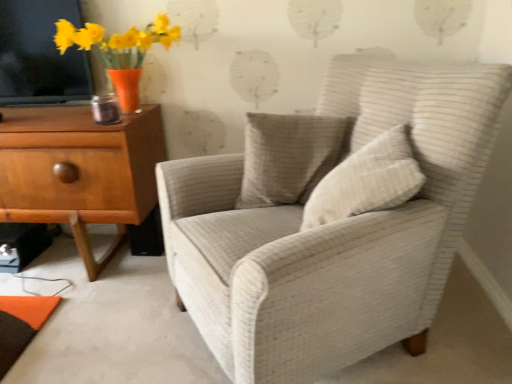
Describe the element at coordinates (119, 51) in the screenshot. I see `matte orange vase with yellow flowers at upper left` at that location.

The width and height of the screenshot is (512, 384). What do you see at coordinates (366, 181) in the screenshot?
I see `beige textured pillow at center, which ranks as the 2th pillow in back-to-front order` at bounding box center [366, 181].

What do you see at coordinates (289, 156) in the screenshot? This screenshot has width=512, height=384. I see `textured beige pillow at center, which ranks as the second pillow in front-to-back order` at bounding box center [289, 156].

This screenshot has width=512, height=384. Find the location of `matte orange vase with yellow flowers at upper left`. matte orange vase with yellow flowers at upper left is located at coordinates (119, 51).

Can you confirm if light brown wood chest of drawers at left is smaller than white textured armchair at center?

Yes.

Between point (15, 146) and point (463, 182), which one is positioned behind?

Positioned behind is point (15, 146).

Considering the positions of objects light brown wood chest of drawers at left and white textured armchair at center in the image provided, who is behind, light brown wood chest of drawers at left or white textured armchair at center?

Positioned behind is light brown wood chest of drawers at left.

Which object is positioned more to the left, light brown wood chest of drawers at left or white textured armchair at center?

light brown wood chest of drawers at left.

Consider the image. Is beige textured pillow at center, which ranks as the 2th pillow in back-to-front order, surrounded by white textured armchair at center?

Yes, beige textured pillow at center, which ranks as the 2th pillow in back-to-front order, is a part of white textured armchair at center.

Consider the image. Which object is closer to the camera, white textured armchair at center or beige textured pillow at center, which appears as the first pillow when viewed from the front?

white textured armchair at center.

Is point (272, 157) closer or farther from the camera than point (353, 158)?

Point (272, 157) is positioned farther from the camera compared to point (353, 158).

Looking at this image, is beige textured pillow at center, which appears as the first pillow when viewed from the front, completely or partially inside textured beige pillow at center, which ranks as the second pillow in front-to-back order?

Actually, beige textured pillow at center, which appears as the first pillow when viewed from the front, is outside textured beige pillow at center, which ranks as the second pillow in front-to-back order.

Locate an element on the screen. pillow lying on the left of beige textured pillow at center, which ranks as the 2th pillow in back-to-front order is located at coordinates click(289, 156).

Measure the distance from textured beige pillow at center, which is the 1th pillow from back to front, to beige textured pillow at center, which appears as the first pillow when viewed from the front.

The distance of textured beige pillow at center, which is the 1th pillow from back to front, from beige textured pillow at center, which appears as the first pillow when viewed from the front, is 25.45 centimeters.

Is beige textured pillow at center, which ranks as the 2th pillow in back-to-front order, looking in the opposite direction of white textured armchair at center?

Yes.

Considering the relative positions of beige textured pillow at center, which ranks as the 2th pillow in back-to-front order, and white textured armchair at center in the image provided, is beige textured pillow at center, which ranks as the 2th pillow in back-to-front order, in front of white textured armchair at center?

No, the depth of beige textured pillow at center, which ranks as the 2th pillow in back-to-front order, is greater than that of white textured armchair at center.

Are beige textured pillow at center, which ranks as the 2th pillow in back-to-front order, and white textured armchair at center far apart?

That's not correct — beige textured pillow at center, which ranks as the 2th pillow in back-to-front order, is a little close to white textured armchair at center.

Between beige textured pillow at center, which appears as the first pillow when viewed from the front, and white textured armchair at center, which one has smaller size?

With smaller size is beige textured pillow at center, which appears as the first pillow when viewed from the front.

Based on the photo, is beige textured pillow at center, which ranks as the 2th pillow in back-to-front order, further to the viewer compared to textured beige pillow at center, which ranks as the second pillow in front-to-back order?

No, it is in front of textured beige pillow at center, which ranks as the second pillow in front-to-back order.

Is the surface of beige textured pillow at center, which appears as the first pillow when viewed from the front, in direct contact with textured beige pillow at center, which ranks as the second pillow in front-to-back order?

They are not placed beside each other.

Who is shorter, beige textured pillow at center, which appears as the first pillow when viewed from the front, or textured beige pillow at center, which is the 1th pillow from back to front?

With less height is beige textured pillow at center, which appears as the first pillow when viewed from the front.

Is textured beige pillow at center, which is the 1th pillow from back to front, completely or partially outside of matte orange vase with yellow flowers at upper left?

Indeed, textured beige pillow at center, which is the 1th pillow from back to front, is completely outside matte orange vase with yellow flowers at upper left.

Between textured beige pillow at center, which is the 1th pillow from back to front, and matte orange vase with yellow flowers at upper left, which one appears on the right side from the viewer's perspective?

textured beige pillow at center, which is the 1th pillow from back to front.

Could you tell me if textured beige pillow at center, which ranks as the second pillow in front-to-back order, is turned towards matte orange vase with yellow flowers at upper left?

No, textured beige pillow at center, which ranks as the second pillow in front-to-back order, is not aimed at matte orange vase with yellow flowers at upper left.

Is point (347, 120) less distant than point (135, 44)?

That is True.

Considering the relative positions of matte orange vase with yellow flowers at upper left and beige textured pillow at center, which appears as the first pillow when viewed from the front, in the image provided, is matte orange vase with yellow flowers at upper left to the left or to the right of beige textured pillow at center, which appears as the first pillow when viewed from the front,?

From the image, it's evident that matte orange vase with yellow flowers at upper left is to the left of beige textured pillow at center, which appears as the first pillow when viewed from the front.

Is point (112, 75) in front of point (403, 133)?

No, (112, 75) is further to viewer.

Considering the sizes of matte orange vase with yellow flowers at upper left and beige textured pillow at center, which ranks as the 2th pillow in back-to-front order, in the image, is matte orange vase with yellow flowers at upper left wider or thinner than beige textured pillow at center, which ranks as the 2th pillow in back-to-front order,?

Considering their sizes, matte orange vase with yellow flowers at upper left looks broader than beige textured pillow at center, which ranks as the 2th pillow in back-to-front order.

Which object is closer to the camera taking this photo, matte orange vase with yellow flowers at upper left or beige textured pillow at center, which appears as the first pillow when viewed from the front?

beige textured pillow at center, which appears as the first pillow when viewed from the front, is closer to the camera.

Where is `chest of drawers behind the white textured armchair at center`? The image size is (512, 384). chest of drawers behind the white textured armchair at center is located at coordinates (82, 173).

Locate an element on the screen. The width and height of the screenshot is (512, 384). chair in front of the beige textured pillow at center, which ranks as the 2th pillow in back-to-front order is located at coordinates click(x=327, y=222).

When comparing their distances from light brown wood chest of drawers at left, does textured beige pillow at center, which ranks as the second pillow in front-to-back order, or matte orange vase with yellow flowers at upper left seem further?

Among the two, textured beige pillow at center, which ranks as the second pillow in front-to-back order, is located further to light brown wood chest of drawers at left.

Considering their positions, is beige textured pillow at center, which ranks as the 2th pillow in back-to-front order, positioned closer to light brown wood chest of drawers at left than textured beige pillow at center, which ranks as the second pillow in front-to-back order?

Based on the image, textured beige pillow at center, which ranks as the second pillow in front-to-back order, appears to be nearer to light brown wood chest of drawers at left.

Considering their positions, is light brown wood chest of drawers at left positioned closer to white textured armchair at center than matte orange vase with yellow flowers at upper left?

The object closer to white textured armchair at center is light brown wood chest of drawers at left.

Based on the photo, looking at the image, which one is located closer to textured beige pillow at center, which ranks as the second pillow in front-to-back order, beige textured pillow at center, which appears as the first pillow when viewed from the front, or light brown wood chest of drawers at left?

Based on the image, beige textured pillow at center, which appears as the first pillow when viewed from the front, appears to be nearer to textured beige pillow at center, which ranks as the second pillow in front-to-back order.

Looking at the image, which one is located further to textured beige pillow at center, which is the 1th pillow from back to front, white textured armchair at center or matte orange vase with yellow flowers at upper left?

The object further to textured beige pillow at center, which is the 1th pillow from back to front, is matte orange vase with yellow flowers at upper left.

Considering their positions, is light brown wood chest of drawers at left positioned closer to matte orange vase with yellow flowers at upper left than beige textured pillow at center, which ranks as the 2th pillow in back-to-front order?

light brown wood chest of drawers at left lies closer to matte orange vase with yellow flowers at upper left than the other object.

Considering their positions, is white textured armchair at center positioned closer to light brown wood chest of drawers at left than textured beige pillow at center, which ranks as the second pillow in front-to-back order?

Among the two, textured beige pillow at center, which ranks as the second pillow in front-to-back order, is located nearer to light brown wood chest of drawers at left.

From the image, which object appears to be farther from textured beige pillow at center, which is the 1th pillow from back to front, light brown wood chest of drawers at left or beige textured pillow at center, which ranks as the 2th pillow in back-to-front order?

The object further to textured beige pillow at center, which is the 1th pillow from back to front, is light brown wood chest of drawers at left.

What are the coordinates of `floral arrangement between light brown wood chest of drawers at left and beige textured pillow at center, which ranks as the 2th pillow in back-to-front order` in the screenshot? It's located at (119, 51).

Where is `floral arrangement between light brown wood chest of drawers at left and white textured armchair at center in the horizontal direction`? Image resolution: width=512 pixels, height=384 pixels. floral arrangement between light brown wood chest of drawers at left and white textured armchair at center in the horizontal direction is located at coordinates (119, 51).

Identify the location of pillow between matte orange vase with yellow flowers at upper left and beige textured pillow at center, which ranks as the 2th pillow in back-to-front order, from left to right. (289, 156).

This screenshot has width=512, height=384. What are the coordinates of `floral arrangement between light brown wood chest of drawers at left and textured beige pillow at center, which is the 1th pillow from back to front, from left to right` in the screenshot? It's located at coord(119,51).